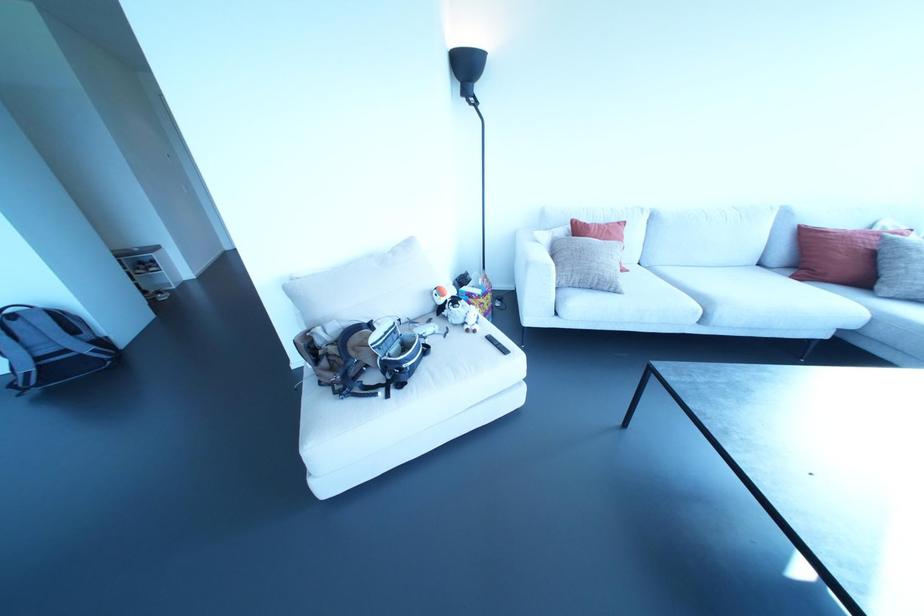
Identify the location of grey and black backpack. The height and width of the screenshot is (616, 924). (50, 346).